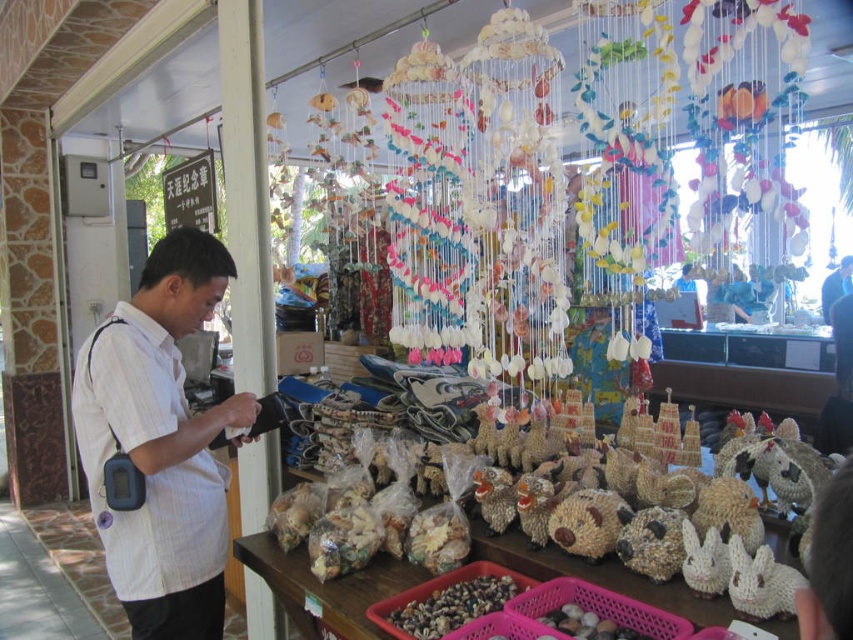
Which is more to the left, brown woven baskets at center or natural seashells at center?

From the viewer's perspective, brown woven baskets at center appears more on the left side.

Consider the image. Who is positioned more to the right, brown woven baskets at center or natural seashells at center?

From the viewer's perspective, natural seashells at center appears more on the right side.

Does point (698, 620) come in front of point (540, 621)?

Yes, it is.

Locate an element on the screen. This screenshot has height=640, width=853. brown woven baskets at center is located at coordinates (334, 589).

Is white striped shirt at left above brown woven baskets at center?

Correct, white striped shirt at left is located above brown woven baskets at center.

Between white striped shirt at left and brown woven baskets at center, which one appears on the right side from the viewer's perspective?

Positioned to the right is brown woven baskets at center.

Where is `white striped shirt at left`? Image resolution: width=853 pixels, height=640 pixels. white striped shirt at left is located at coordinates (160, 442).

Does brown woven baskets at center lie behind smooth brown shells at lower center?

No, it is in front of smooth brown shells at lower center.

The width and height of the screenshot is (853, 640). What do you see at coordinates (334, 589) in the screenshot? I see `brown woven baskets at center` at bounding box center [334, 589].

At what (x,y) coordinates should I click in order to perform the action: click on brown woven baskets at center. Please return your answer as a coordinate pair (x, y). Image resolution: width=853 pixels, height=640 pixels. Looking at the image, I should click on (334, 589).